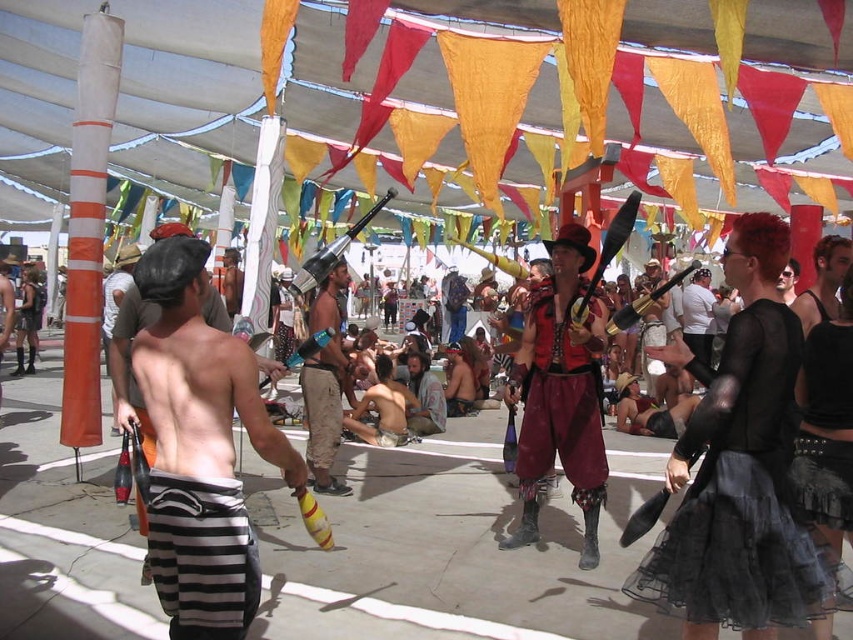
You are a performer at the festival who needs to move from your current position near the black sheer top at center to the camouflage fabric shorts at center. The stage manager says the minimum safe distance between performers is 3 meters to avoid collisions. Is your current distance compliant with the safety guidelines?

The distance between the black sheer top at center and camouflage fabric shorts at center is 2.91 meters, which is less than the required 3 meters. Therefore, the current distance does not comply with the safety guidelines.

You are standing at the point marked as point (x=737, y=468) in the image. What object is directly beneath you?

The point (x=737, y=468) is on the black sheer top at center.